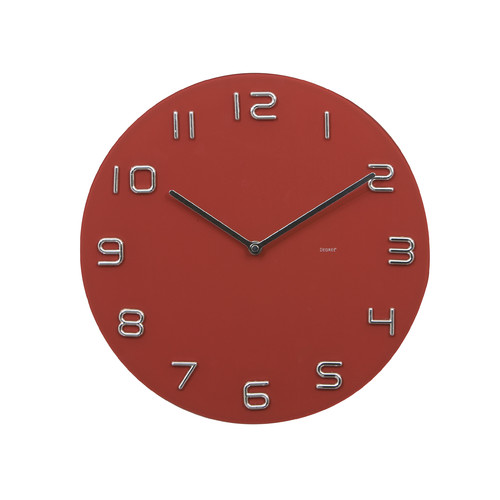
In order to click on center of clock in this screenshot , I will do `click(255, 246)`.